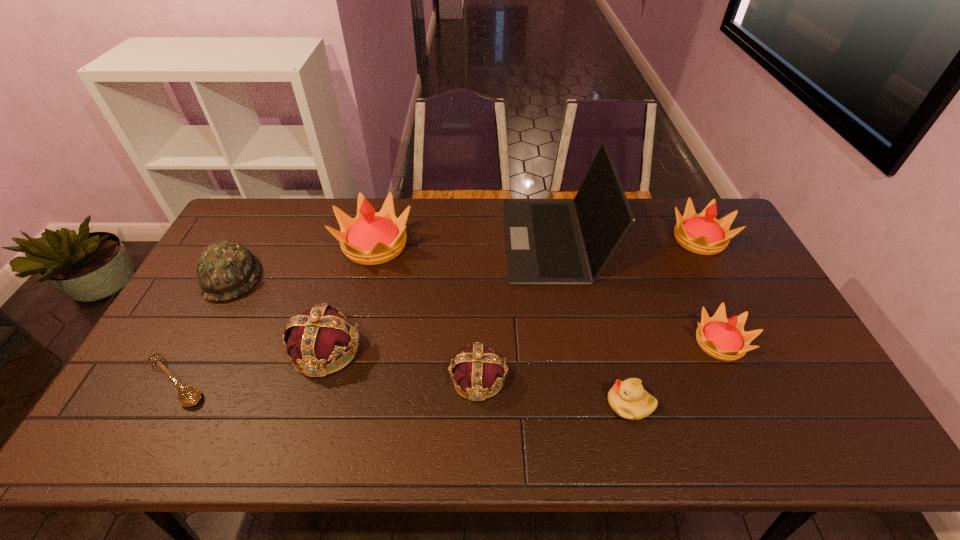
The width and height of the screenshot is (960, 540). Find the location of `the tallest object`. the tallest object is located at coordinates (548, 242).

Where is `the second tallest object`? The width and height of the screenshot is (960, 540). the second tallest object is located at coordinates (371, 238).

Locate an element on the screen. The image size is (960, 540). the biggest yellow crown is located at coordinates (371, 238).

Find the location of a particular element. Image resolution: width=960 pixels, height=540 pixels. the second smallest yellow crown is located at coordinates (702, 233).

This screenshot has width=960, height=540. In order to click on the bigger purple crown in this screenshot , I will do `click(320, 335)`.

Locate an element on the screen. the smallest yellow crown is located at coordinates (724, 339).

I want to click on headwear, so click(x=226, y=269).

The width and height of the screenshot is (960, 540). What are the coordinates of `the right purple crown` in the screenshot? It's located at (477, 372).

The width and height of the screenshot is (960, 540). Find the location of `the smaller purple crown`. the smaller purple crown is located at coordinates (477, 372).

Locate an element on the screen. This screenshot has width=960, height=540. duckling is located at coordinates (628, 399).